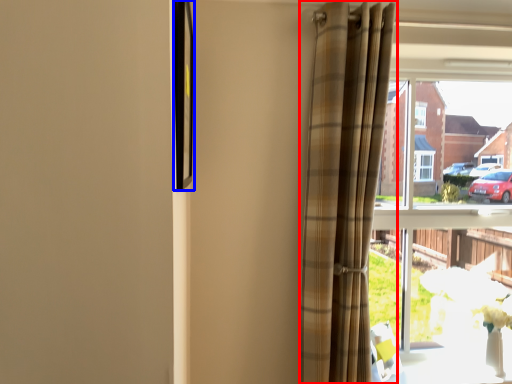
Question: Which point is closer to the camera, curtain (highlighted by a red box) or picture frame (highlighted by a blue box)?

Choices:
 (A) curtain
 (B) picture frame

Answer: (B)